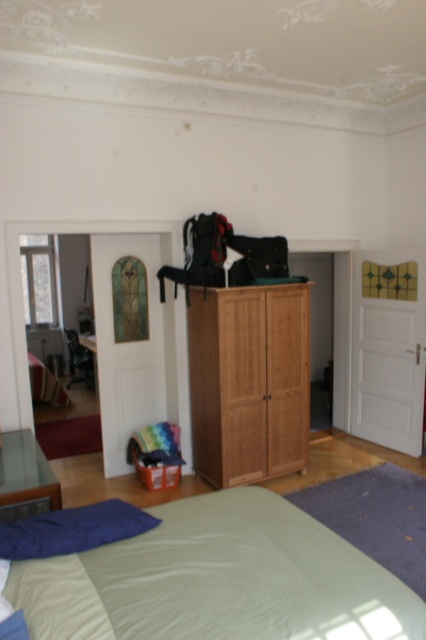
Based on the photo, you are a delivery person who needs to place a package that is 5 feet long on the floor between the light brown wood wardrobe at center and the blue fabric pillow at lower left. Can the package fit in that space?

The distance between the light brown wood wardrobe at center and the blue fabric pillow at lower left is 6.05 feet, so the 5 feet long package can fit in that space since it is shorter than the available distance.

You are standing in the room and want to place a small plant between the two points, point(247, 497) and point(6, 467). Based on their positions, which point should the plant be closer to in order to be nearer to the viewer?

The plant should be placed closer to point(247, 497) because it is closer to the viewer than point(6, 467).